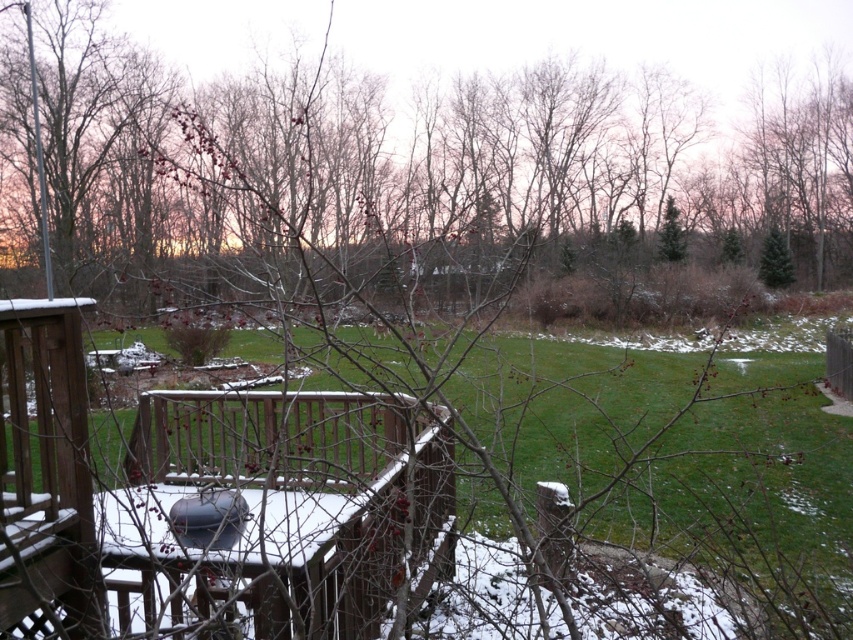
How distant is green grass at center from wooden deck at lower left?

green grass at center is 14.40 feet from wooden deck at lower left.

Who is positioned more to the right, green grass at center or wooden deck at lower left?

green grass at center is more to the right.

Who is more forward, (422, 540) or (436, 556)?

Point (422, 540) is more forward.

Identify the location of green grass at center. This screenshot has height=640, width=853. (410, 536).